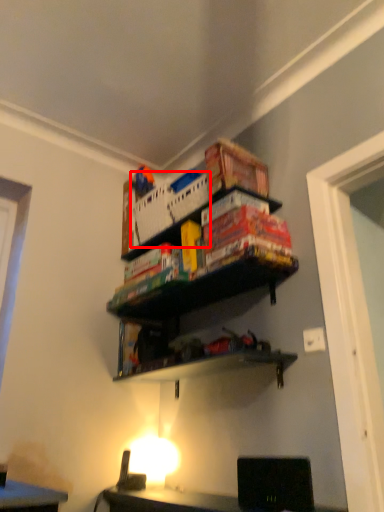
Question: Considering the relative positions of crate (annotated by the red box) and shelf in the image provided, where is crate (annotated by the red box) located with respect to the staircase?

Choices:
 (A) left
 (B) right

Answer: (A)